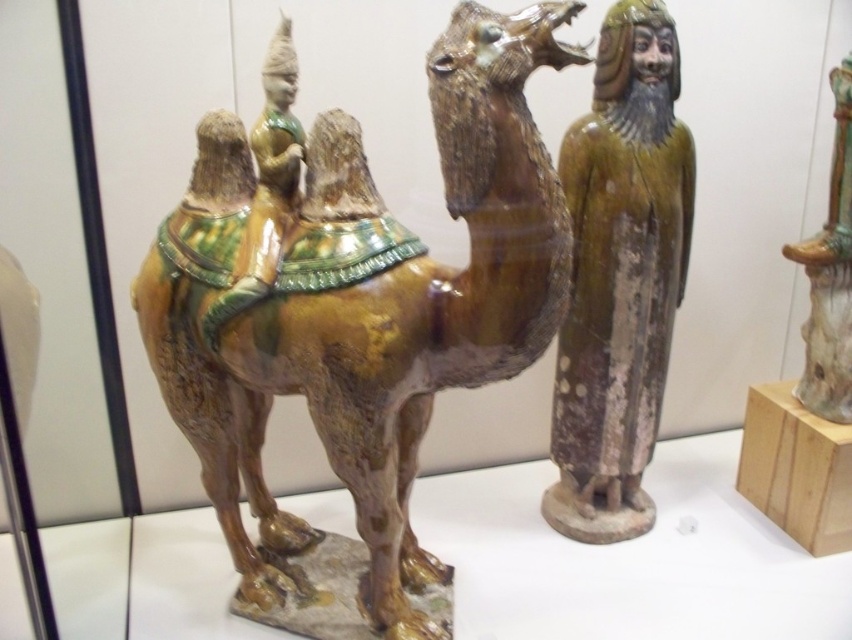
You are a museum curator planning to place a new sculpture on a shelf between the brown glossy camel at center and the shiny green ceramic vase at upper right. The sculpture is 10 cm tall. Which object should you place it next to so that it doesn

The brown glossy camel at center is taller than the shiny green ceramic vase at upper right. Therefore, placing the 10 cm tall sculpture next to the shiny green ceramic vase at upper right would ensure it is not overshadowed by the taller camel.

You are a curator arranging an exhibit and need to place a new sign next to the brown glossy camel at center. The sign must be placed at coordinates between x 0.4 and x 0.5 on the same y level as the camel. Is the current position of the camel suitable for placing the sign within these coordinates?

The brown glossy camel at center is located at point (366, 305). Since the x coordinate 0.478 falls between 0.4 and 0.5, the sign can be placed at the same y level as the camel within the specified x range.

You are a museum curator planning to place a protective glass case around the brown glossy camel at center and the shiny green ceramic vase at upper right. The case must accommodate both items. Given that the camel is larger, will the case need to be adjusted in size to fit both?

The brown glossy camel at center is larger in size than the shiny green ceramic vase at upper right, so the protective glass case must be sized to accommodate the camel, ensuring both items fit comfortably within the enclosure.